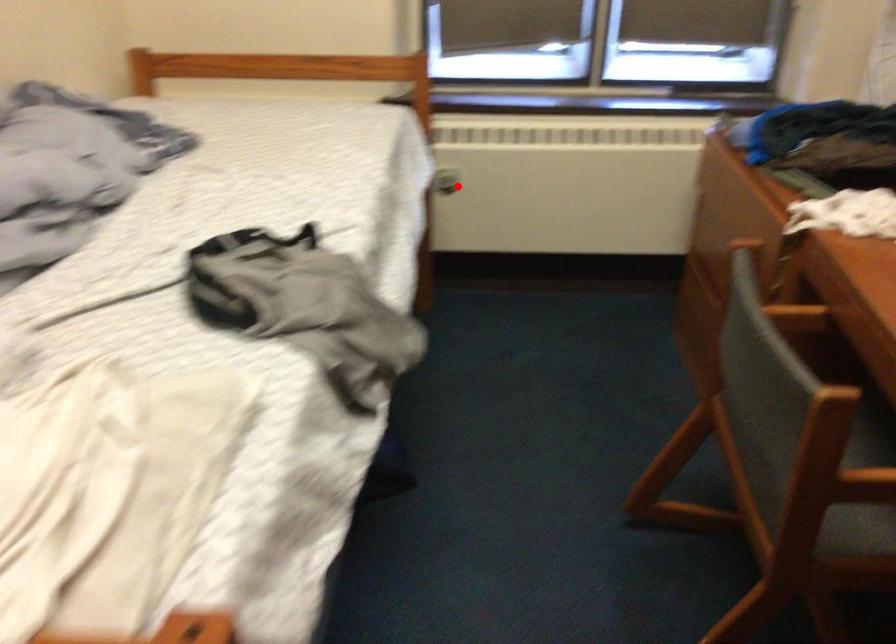
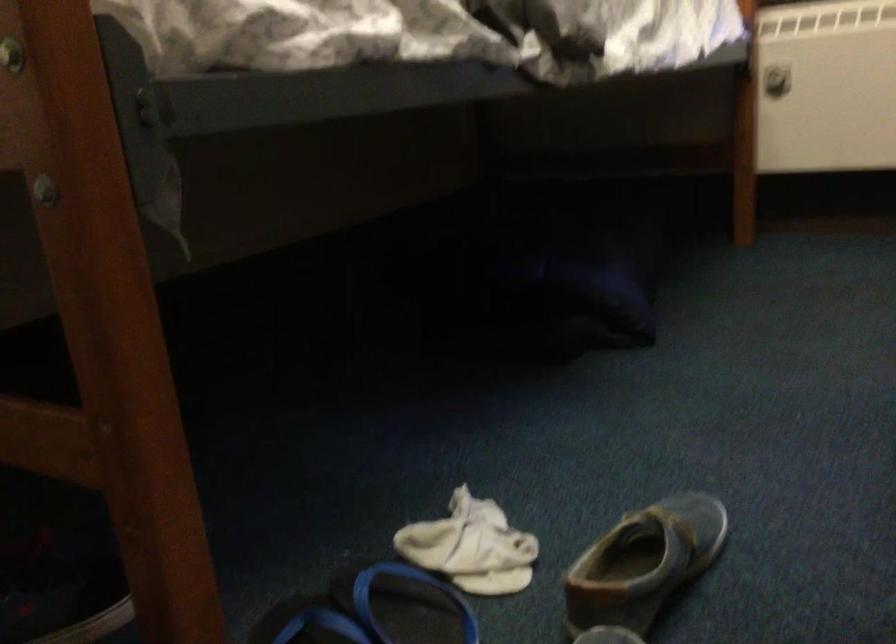
Question: I am providing you with two images of the same scene from different viewpoints. Image1 has a red point marked. In image2, the corresponding 3D location appears at what relative position? Reply with the corresponding letter.

Choices:
 (A) Closer
 (B) Farther

Answer: (A)